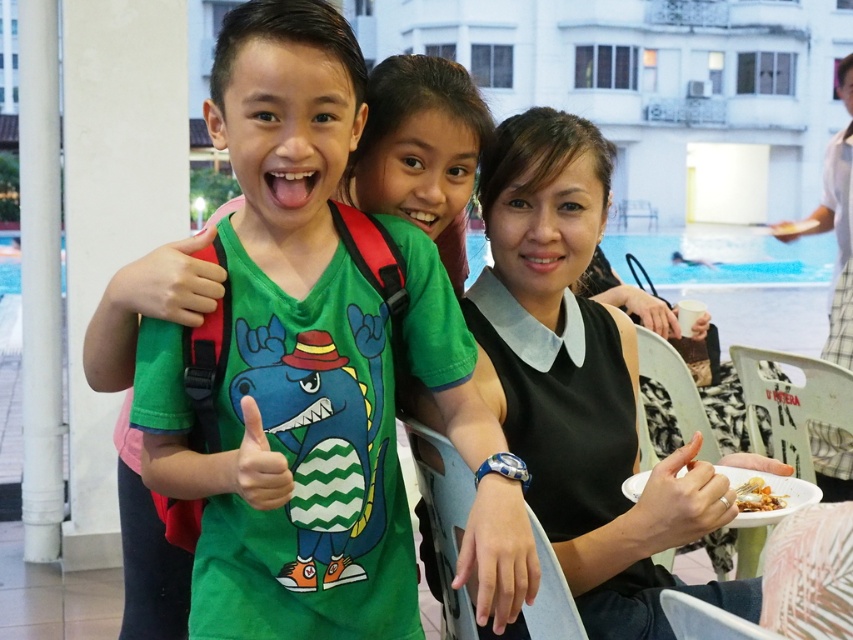
Question: Which object appears farthest from the camera in this image?

Choices:
 (A) green matte t-shirt at center
 (B) golden crispy fried chicken at lower right
 (C) matte green t-shirt at center

Answer: (B)

Question: Which of the following is the closest to the observer?

Choices:
 (A) golden crispy fried chicken at lower right
 (B) matte green t-shirt at center

Answer: (B)

Question: Which of the following is the closest to the observer?

Choices:
 (A) matte green t-shirt at center
 (B) green matte t-shirt at center

Answer: (B)

Question: Does green matte t-shirt at center have a lesser width compared to golden crispy fried chicken at lower right?

Choices:
 (A) no
 (B) yes

Answer: (A)

Question: From the image, what is the correct spatial relationship of green matte t-shirt at center in relation to golden crispy fried chicken at lower right?

Choices:
 (A) above
 (B) below

Answer: (A)

Question: Where is matte green t-shirt at center located in relation to golden crispy fried chicken at lower right in the image?

Choices:
 (A) above
 (B) below

Answer: (A)